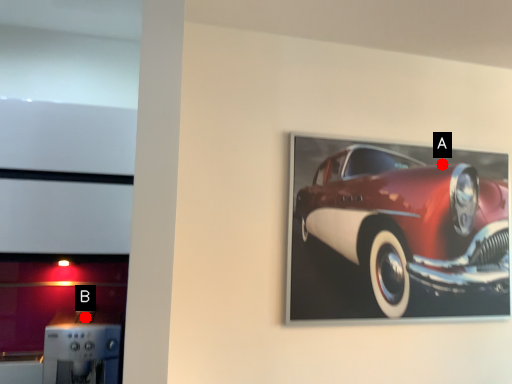
Question: Two points are circled on the image, labeled by A and B beside each circle. Which of the following is the closest to the observer?

Choices:
 (A) A is closer
 (B) B is closer

Answer: (B)